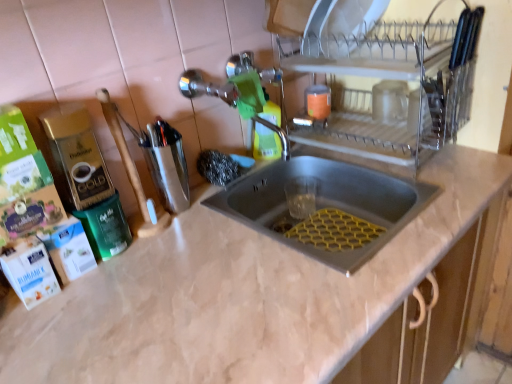
At what (x,y) coordinates should I click in order to perform the action: click on free spot to the right of metallic silver utensil holder at center-left, placed as the first appliance when sorted from left to right. Please return your answer as a coordinate pair (x, y). Looking at the image, I should click on (224, 210).